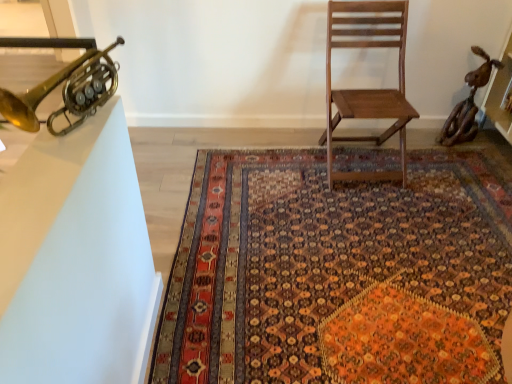
Locate an element on the screen. blank area beneath carpet with intricate patterns at center (from a real-world perspective) is located at coordinates (361, 236).